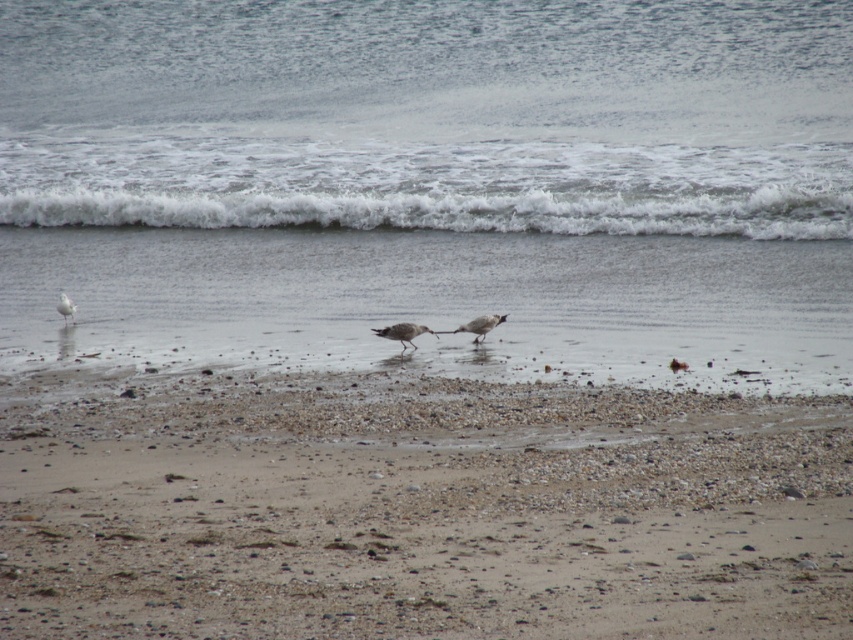
Question: Which object is the closest to the gray feathered bird at center?

Choices:
 (A) white frothy water at center
 (B) brown gravelly sand at lower center

Answer: (B)

Question: Is white feathered bird at center in front of white matte seagull at left?

Choices:
 (A) no
 (B) yes

Answer: (B)

Question: Can you confirm if brown gravelly sand at lower center is positioned to the right of gray feathered bird at center?

Choices:
 (A) yes
 (B) no

Answer: (B)

Question: Does white frothy water at center appear on the right side of brown gravelly sand at lower center?

Choices:
 (A) yes
 (B) no

Answer: (A)

Question: Which point is closer to the camera?

Choices:
 (A) (463, 332)
 (B) (73, 321)
 (C) (401, 353)

Answer: (C)

Question: Which point is farther to the camera?

Choices:
 (A) (378, 483)
 (B) (62, 308)
 (C) (431, 330)

Answer: (B)